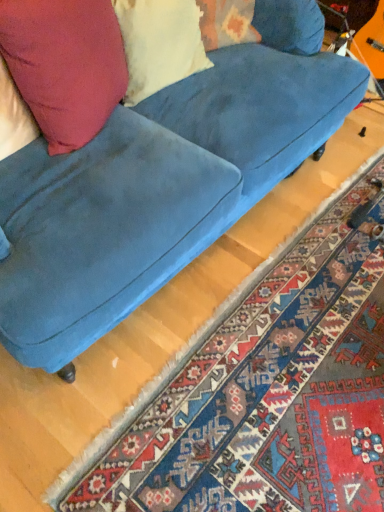
Question: Could matte yellow pillow at upper left be considered to be inside carpet with intricate patterns at lower right?

Choices:
 (A) no
 (B) yes

Answer: (A)

Question: Does carpet with intricate patterns at lower right have a smaller size compared to matte yellow pillow at upper left?

Choices:
 (A) yes
 (B) no

Answer: (B)

Question: Is carpet with intricate patterns at lower right positioned with its back to matte yellow pillow at upper left?

Choices:
 (A) yes
 (B) no

Answer: (B)

Question: Is carpet with intricate patterns at lower right positioned before matte yellow pillow at upper left?

Choices:
 (A) no
 (B) yes

Answer: (B)

Question: Could you tell me if carpet with intricate patterns at lower right is turned towards matte yellow pillow at upper left?

Choices:
 (A) yes
 (B) no

Answer: (B)

Question: Based on their sizes in the image, would you say carpet with intricate patterns at lower right is bigger or smaller than velvet blue couch at center?

Choices:
 (A) big
 (B) small

Answer: (B)

Question: Considering the positions of carpet with intricate patterns at lower right and velvet blue couch at center in the image, is carpet with intricate patterns at lower right wider or thinner than velvet blue couch at center?

Choices:
 (A) wide
 (B) thin

Answer: (A)

Question: Based on their positions, is carpet with intricate patterns at lower right located to the left or right of velvet blue couch at center?

Choices:
 (A) left
 (B) right

Answer: (B)

Question: Considering their positions, is carpet with intricate patterns at lower right located in front of or behind velvet blue couch at center?

Choices:
 (A) front
 (B) behind

Answer: (B)

Question: From the image's perspective, is velvet blue couch at center located above or below matte yellow pillow at upper left?

Choices:
 (A) below
 (B) above

Answer: (A)

Question: Is velvet blue couch at center in front of or behind matte yellow pillow at upper left in the image?

Choices:
 (A) behind
 (B) front

Answer: (B)

Question: Does point (249, 46) appear closer or farther from the camera than point (162, 74)?

Choices:
 (A) farther
 (B) closer

Answer: (A)

Question: Is velvet blue couch at center situated inside matte yellow pillow at upper left or outside?

Choices:
 (A) outside
 (B) inside

Answer: (A)

Question: Considering the positions of matte yellow pillow at upper left and matte pink pillow at upper left in the image, is matte yellow pillow at upper left taller or shorter than matte pink pillow at upper left?

Choices:
 (A) tall
 (B) short

Answer: (B)

Question: Is point 130,31 positioned closer to the camera than point 77,48?

Choices:
 (A) farther
 (B) closer

Answer: (A)